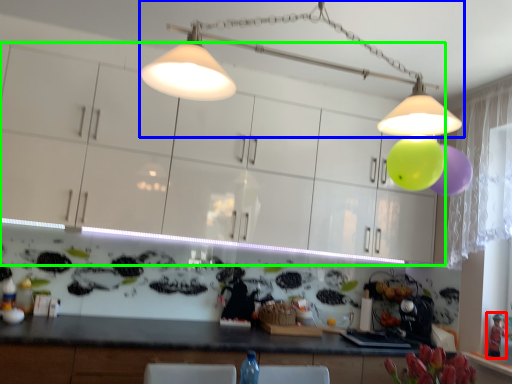
Question: Estimate the real-world distances between objects in this image. Which object is farther from toy (highlighted by a red box), lamp (highlighted by a blue box) or cabinetry (highlighted by a green box)?

Choices:
 (A) lamp
 (B) cabinetry

Answer: (A)